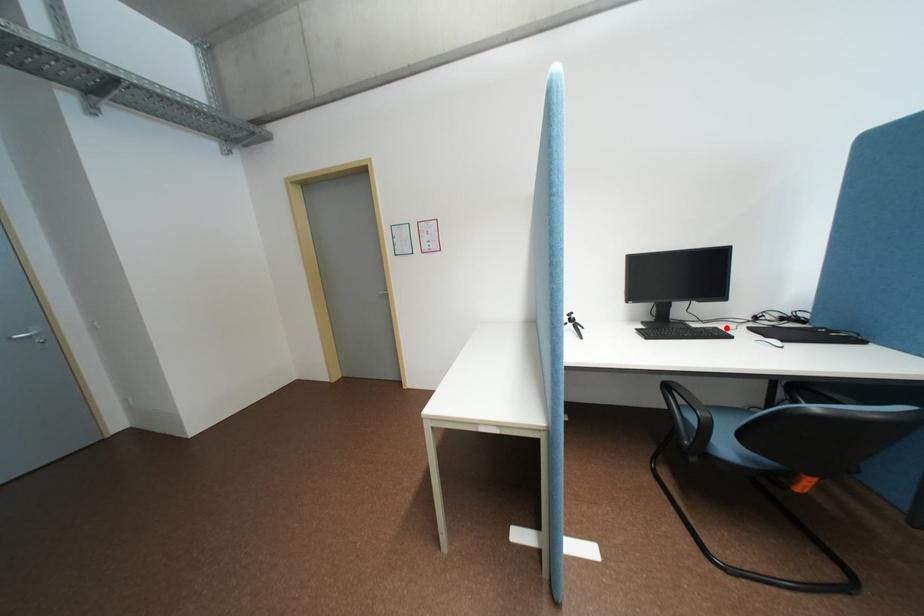
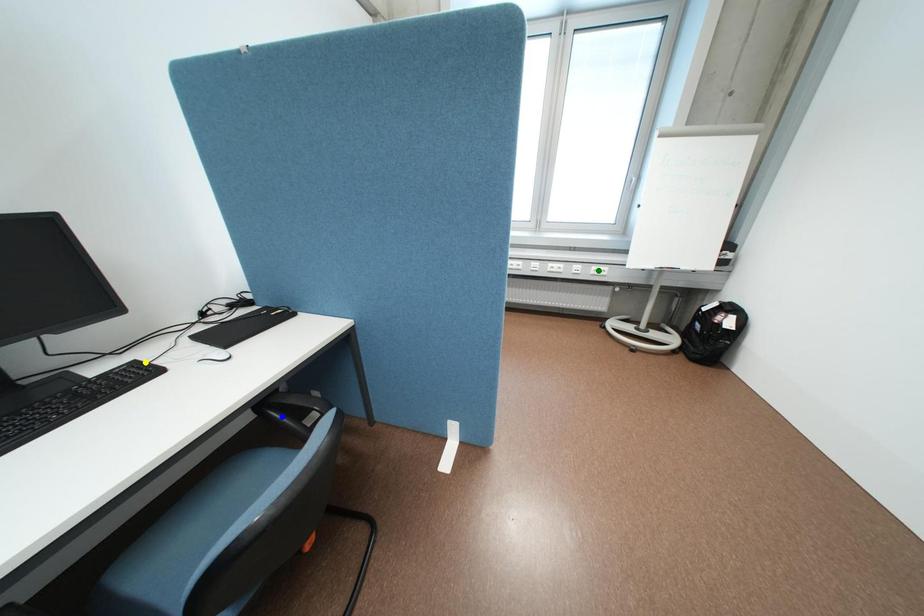
Question: I am providing you with two images of the same scene from different viewpoints. A red point is marked on the first image. You are given multiple points on the second image. Which mark in image 2 goes with the point in image 1?

Choices:
 (A) yellow point
 (B) blue point
 (C) green point

Answer: (A)